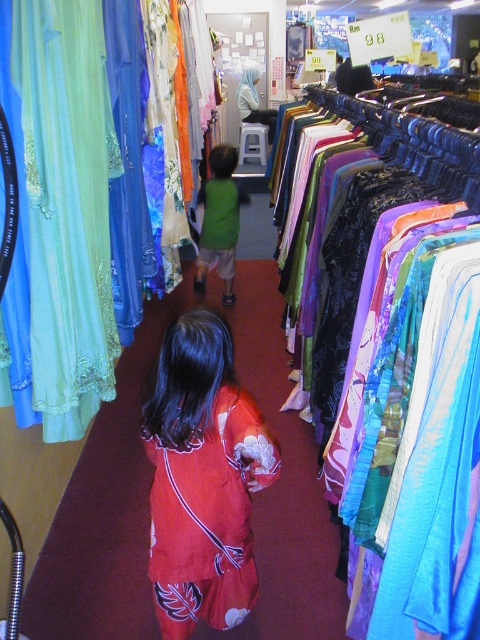
Question: Does red satin blouse at center appear over shiny blue fabric at right?

Choices:
 (A) yes
 (B) no

Answer: (B)

Question: Which object is closer to the camera taking this photo?

Choices:
 (A) red satin blouse at center
 (B) shiny blue fabric at right
 (C) green matte shirt at center

Answer: (B)

Question: Can you confirm if red satin blouse at center is positioned to the left of green matte shirt at center?

Choices:
 (A) yes
 (B) no

Answer: (B)

Question: Among these objects, which one is nearest to the camera?

Choices:
 (A) green matte shirt at center
 (B) shiny blue fabric at right

Answer: (B)

Question: Is red satin blouse at center above shiny blue fabric at right?

Choices:
 (A) yes
 (B) no

Answer: (B)

Question: Estimate the real-world distances between objects in this image. Which object is closer to the red satin blouse at center?

Choices:
 (A) shiny blue fabric at right
 (B) green matte shirt at center

Answer: (A)